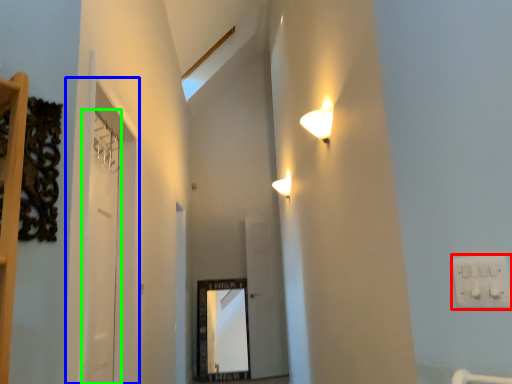
Question: Which object is the farthest from electric outlet (highlighted by a red box)? Choose among these: glass door (highlighted by a blue box) or door (highlighted by a green box).

Choices:
 (A) glass door
 (B) door

Answer: (B)